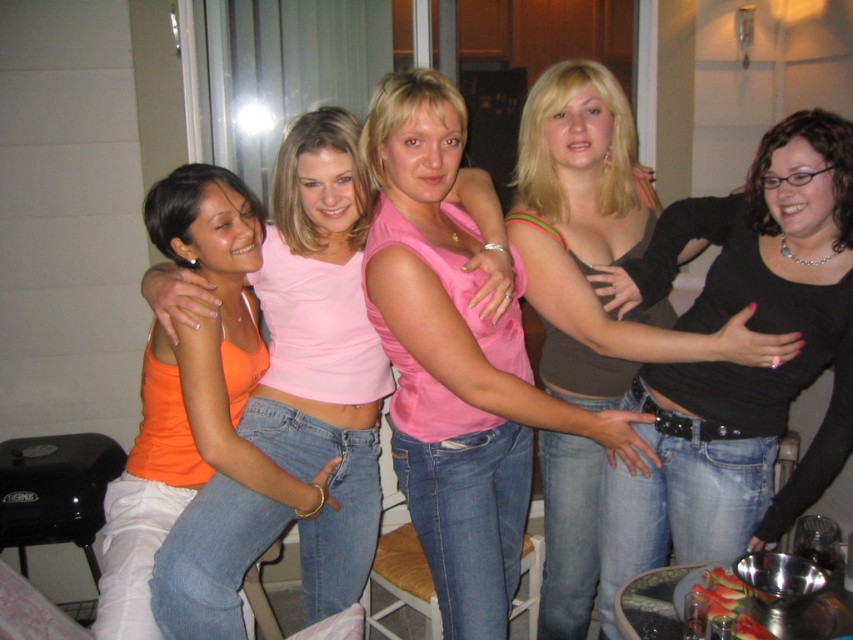
Question: Is pink matte tank top at center closer to the viewer compared to orange matte tank top at center?

Choices:
 (A) no
 (B) yes

Answer: (B)

Question: Among these objects, which one is nearest to the camera?

Choices:
 (A) orange matte tank top at center
 (B) matte pink tank top at center

Answer: (B)

Question: Is matte pink tank top at center bigger than orange matte tank top at center?

Choices:
 (A) yes
 (B) no

Answer: (A)

Question: Observing the image, what is the correct spatial positioning of matte pink tank top at center in reference to orange matte tank top at center?

Choices:
 (A) below
 (B) above

Answer: (A)

Question: Among these objects, which one is farthest from the camera?

Choices:
 (A) matte pink tank top at center
 (B) pink matte tank top at center

Answer: (A)

Question: Which point is closer to the camera?

Choices:
 (A) matte pink tank top at center
 (B) pink matte tank top at center
 (C) orange matte tank top at center

Answer: (B)